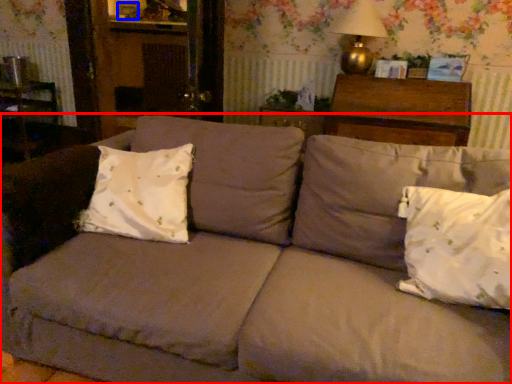
Question: Which of the following is the closest to the observer, studio couch (highlighted by a red box) or picture frame (highlighted by a blue box)?

Choices:
 (A) studio couch
 (B) picture frame

Answer: (A)